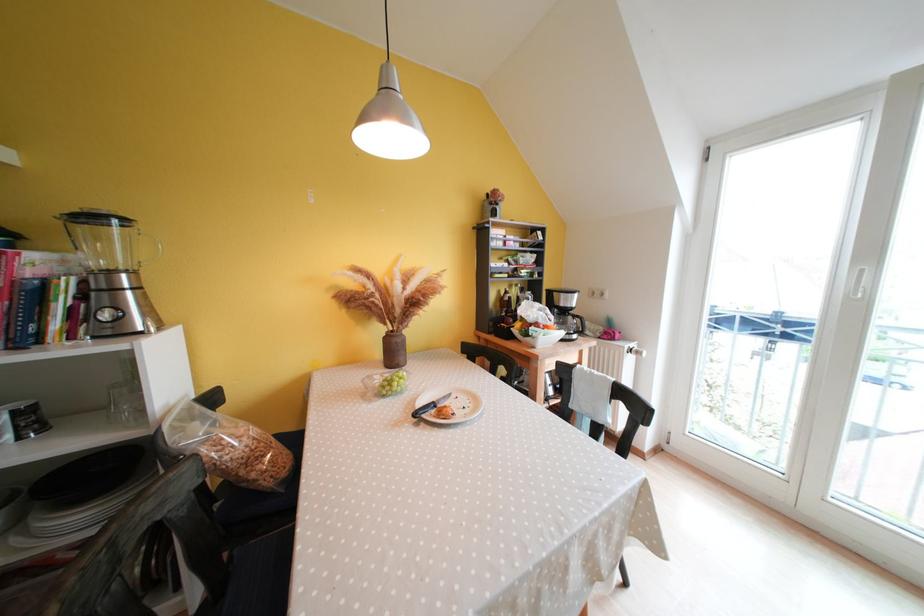
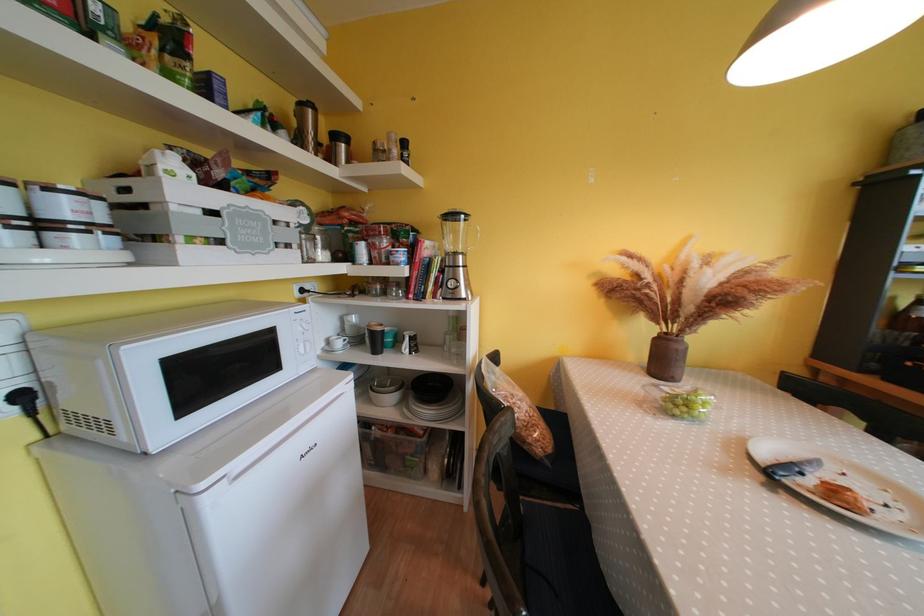
Where in the second image is the point corresponding to (78,313) from the first image?

(444, 282)